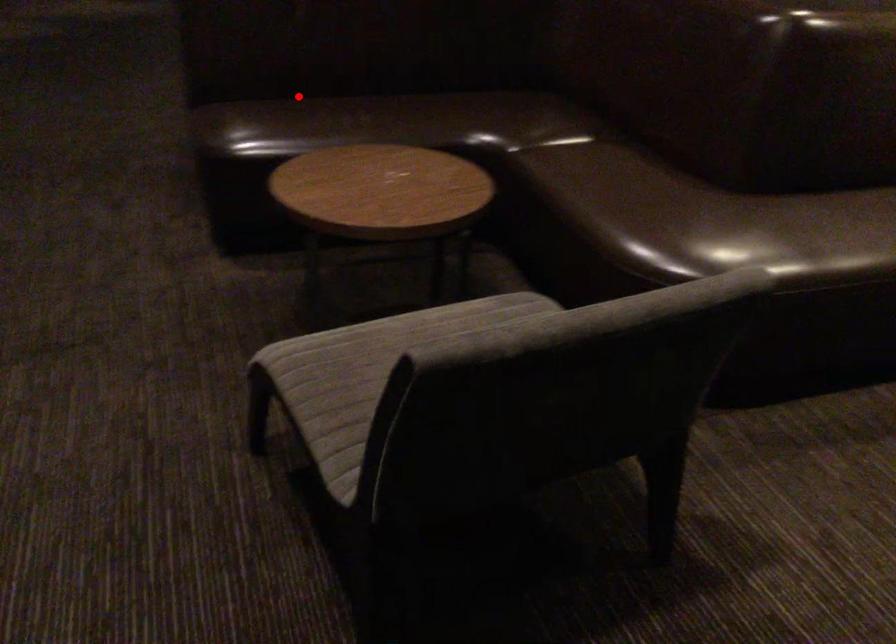
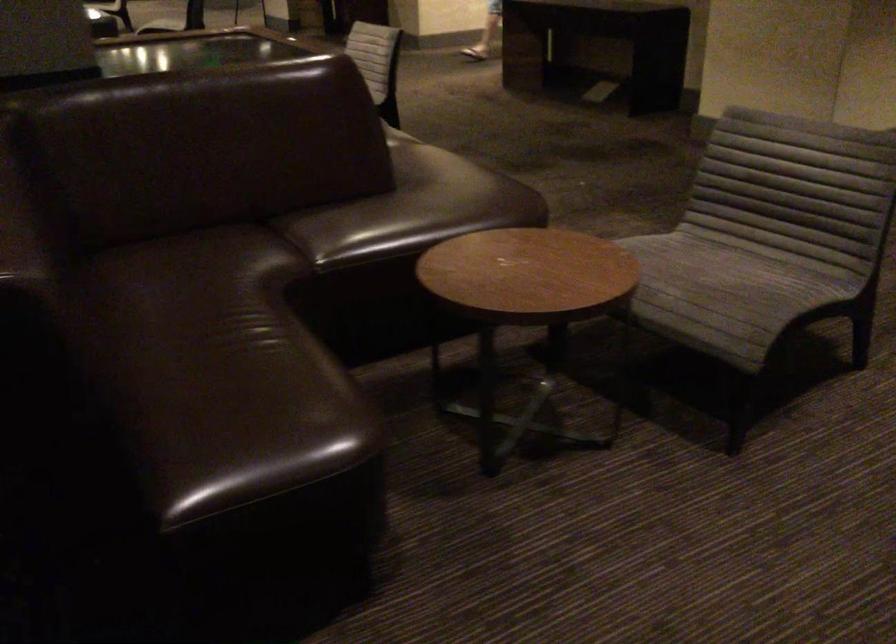
In the second image, find the point that corresponds to the highlighted location in the first image.

(231, 399)